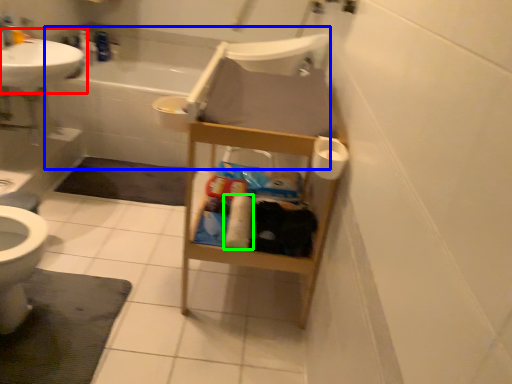
Question: Estimate the real-world distances between objects in this image. Which object is farther from sink (highlighted by a red box), bath (highlighted by a blue box) or toilet paper (highlighted by a green box)?

Choices:
 (A) bath
 (B) toilet paper

Answer: (B)